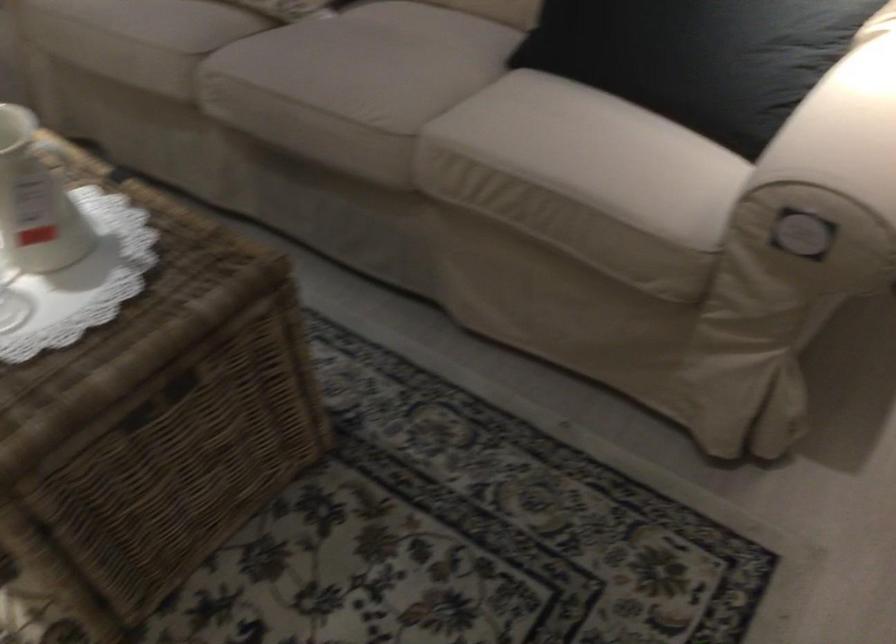
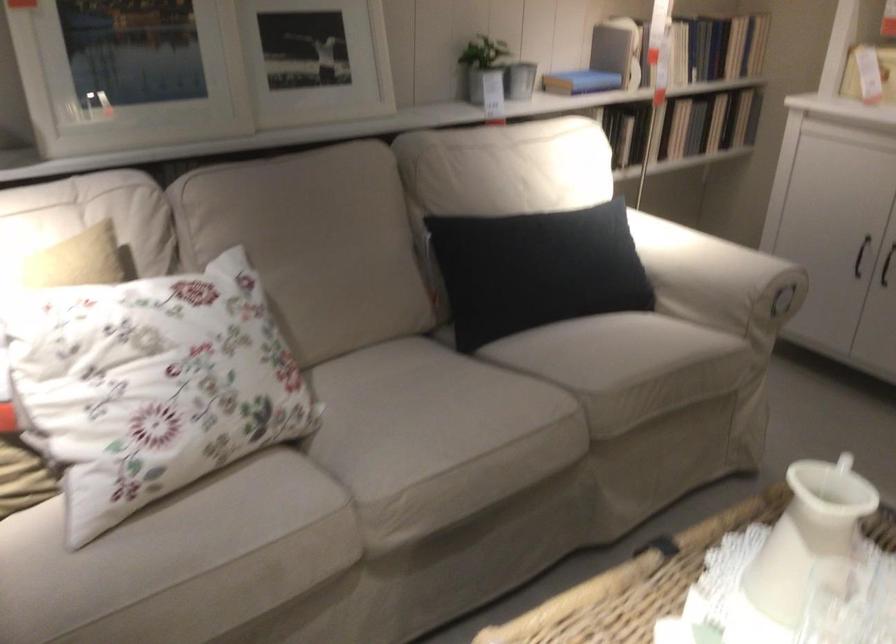
Locate, in the second image, the point that corresponds to (x=772, y=147) in the first image.

(717, 279)